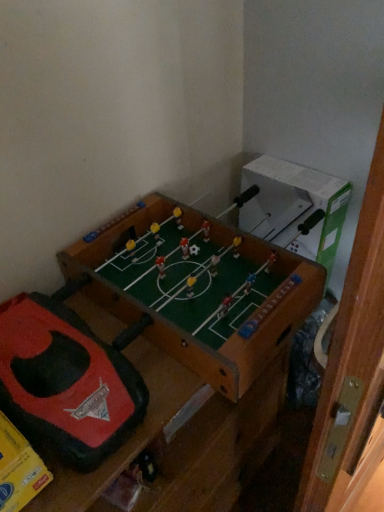
Question: From their relative heights in the image, would you say rubberized red and black toy at center is taller or shorter than wooden foosball table at center?

Choices:
 (A) short
 (B) tall

Answer: (A)

Question: Based on their sizes in the image, would you say rubberized red and black toy at center is bigger or smaller than wooden foosball table at center?

Choices:
 (A) small
 (B) big

Answer: (A)

Question: Is rubberized red and black toy at center inside or outside of wooden foosball table at center?

Choices:
 (A) inside
 (B) outside

Answer: (A)

Question: From a real-world perspective, is wooden foosball table at center positioned above or below rubberized red and black toy at center?

Choices:
 (A) below
 (B) above

Answer: (A)

Question: Is wooden foosball table at center situated inside rubberized red and black toy at center or outside?

Choices:
 (A) outside
 (B) inside

Answer: (A)

Question: From the image's perspective, relative to rubberized red and black toy at center, is wooden foosball table at center above or below?

Choices:
 (A) above
 (B) below

Answer: (B)

Question: Is point (56, 375) closer or farther from the camera than point (84, 409)?

Choices:
 (A) closer
 (B) farther

Answer: (B)